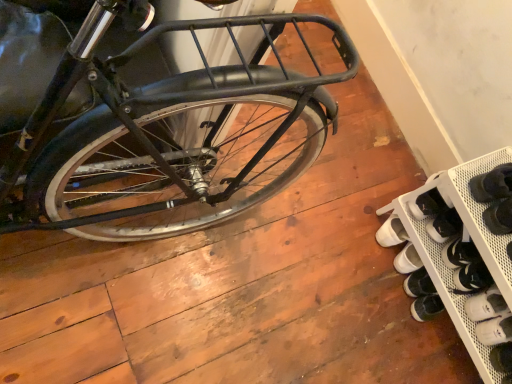
Question: Should I look upward or downward to see white matte shoe at lower right?

Choices:
 (A) down
 (B) up

Answer: (A)

Question: Is white mesh shoe rack at lower right in front of white matte shoe at lower right?

Choices:
 (A) yes
 (B) no

Answer: (A)

Question: Can you confirm if white mesh shoe rack at lower right is smaller than white matte shoe at lower right?

Choices:
 (A) yes
 (B) no

Answer: (B)

Question: From the image's perspective, is white mesh shoe rack at lower right below white matte shoe at lower right?

Choices:
 (A) yes
 (B) no

Answer: (B)

Question: Is white matte shoe at lower right a part of white mesh shoe rack at lower right?

Choices:
 (A) yes
 (B) no

Answer: (A)

Question: Is white mesh shoe rack at lower right at the right side of white matte shoe at lower right?

Choices:
 (A) no
 (B) yes

Answer: (A)

Question: From a real-world perspective, is white mesh shoe rack at lower right on top of white matte shoe at lower right?

Choices:
 (A) no
 (B) yes

Answer: (B)

Question: Does white matte shoe at lower right have a larger size compared to white mesh shoe rack at lower right?

Choices:
 (A) no
 (B) yes

Answer: (A)

Question: Does white matte shoe at lower right have a greater width compared to white mesh shoe rack at lower right?

Choices:
 (A) yes
 (B) no

Answer: (B)

Question: From the image's perspective, does white matte shoe at lower right appear higher than white mesh shoe rack at lower right?

Choices:
 (A) yes
 (B) no

Answer: (B)

Question: From a real-world perspective, is white matte shoe at lower right physically below white mesh shoe rack at lower right?

Choices:
 (A) yes
 (B) no

Answer: (A)

Question: Is white matte shoe at lower right to the right of white mesh shoe rack at lower right from the viewer's perspective?

Choices:
 (A) no
 (B) yes

Answer: (B)

Question: Would you say white matte shoe at lower right is a long distance from white mesh shoe rack at lower right?

Choices:
 (A) no
 (B) yes

Answer: (A)

Question: Is white matte shoe at lower right in front of or behind white mesh shoe rack at lower right in the image?

Choices:
 (A) behind
 (B) front

Answer: (A)